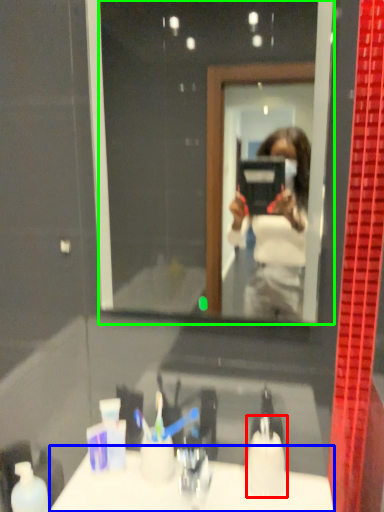
Question: Estimate the real-world distances between objects in this image. Which object is closer to toiletry (highlighted by a red box), counter top (highlighted by a blue box) or mirror (highlighted by a green box)?

Choices:
 (A) counter top
 (B) mirror

Answer: (A)